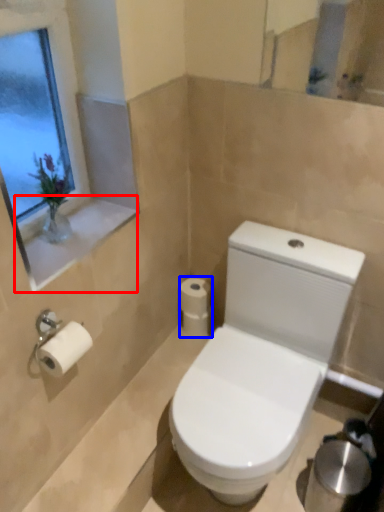
Question: Which point is further to the camera, window sill (highlighted by a red box) or toilet paper (highlighted by a blue box)?

Choices:
 (A) window sill
 (B) toilet paper

Answer: (B)